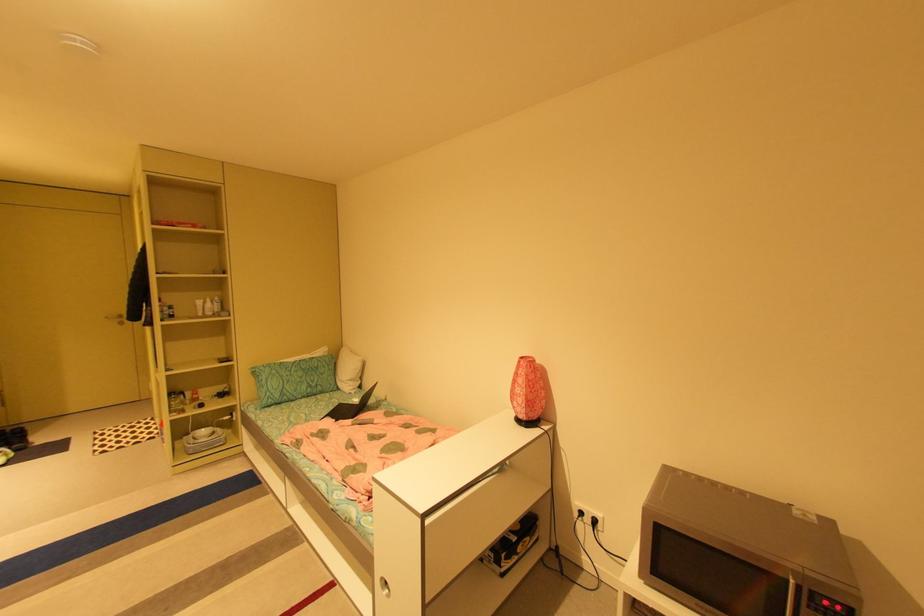
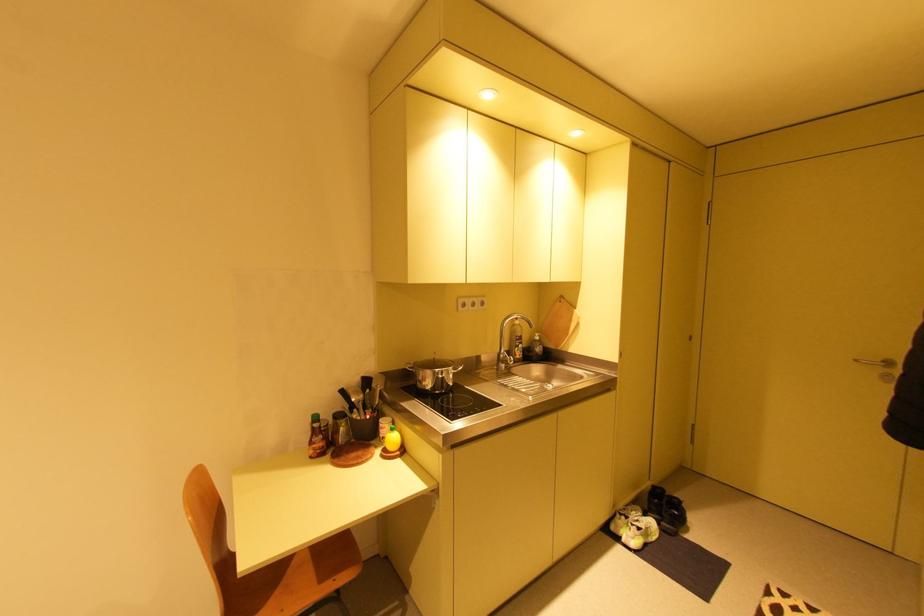
Where in the second image is the point corresponding to (x=113, y=318) from the first image?

(861, 361)